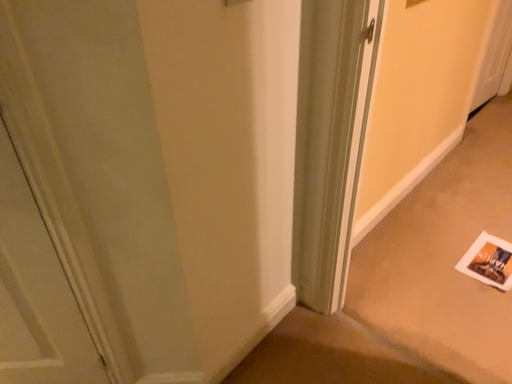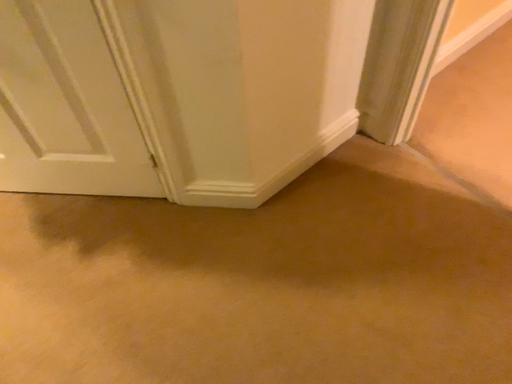
Question: How did the camera likely rotate when shooting the video?

Choices:
 (A) rotated right
 (B) rotated left

Answer: (B)